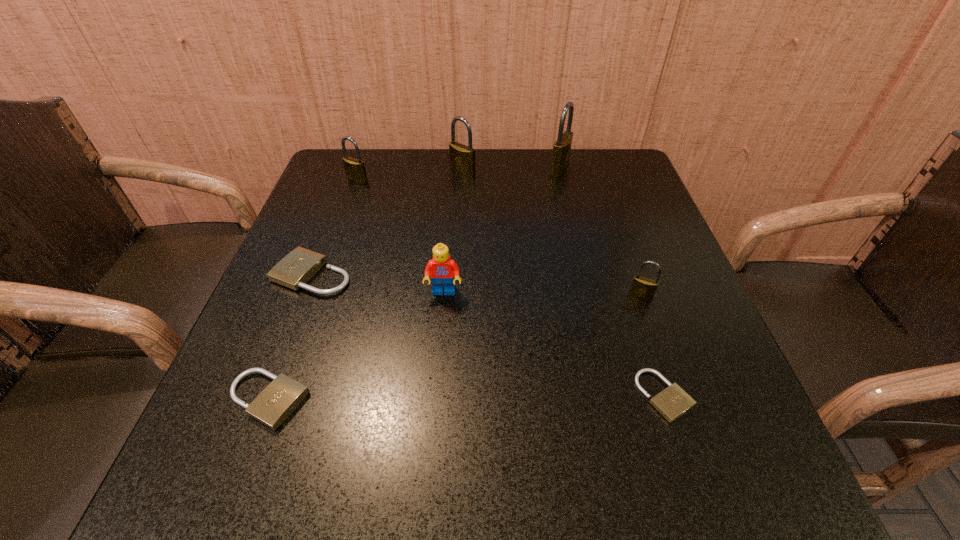
In order to click on the farthest beige padlock in this screenshot , I will do `click(300, 265)`.

The width and height of the screenshot is (960, 540). In order to click on the second smallest beige padlock in this screenshot , I will do `click(281, 397)`.

At what (x,y) coordinates should I click in order to perform the action: click on the second shortest padlock. Please return your answer as a coordinate pair (x, y). The width and height of the screenshot is (960, 540). Looking at the image, I should click on (281, 397).

The image size is (960, 540). Find the location of `the shortest object`. the shortest object is located at coordinates (672, 402).

What are the coordinates of `the rightmost beige padlock` in the screenshot? It's located at (672, 402).

Locate an element on the screen. vacant region located 0.230m on the front of the tallest padlock is located at coordinates (575, 234).

You are a GUI agent. You are given a task and a screenshot of the screen. Output one action in this format:
    pyautogui.click(x=<x>, y=<y>)
    Task: Click on the free spot located 0.270m on the right of the sixth shortest padlock
    The width and height of the screenshot is (960, 540).
    Given the screenshot: What is the action you would take?
    pyautogui.click(x=578, y=171)

Where is `free space located on the right of the third tallest padlock`? The image size is (960, 540). free space located on the right of the third tallest padlock is located at coordinates (505, 180).

The image size is (960, 540). Identify the location of free region located on the face of the Lego. (434, 416).

What are the coordinates of `vacant position located on the left of the fifth tallest object` in the screenshot? It's located at (516, 296).